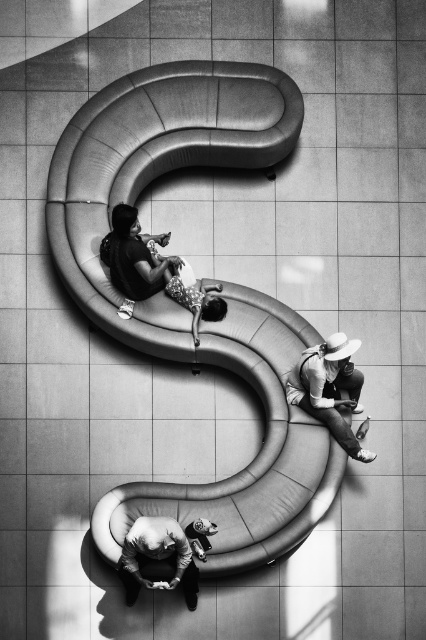
From the picture: Does matte black dress at center have a larger size compared to matte white hat at lower right?

Yes.

Does matte black dress at center have a greater height compared to matte white hat at lower right?

Yes, matte black dress at center is taller than matte white hat at lower right.

The height and width of the screenshot is (640, 426). What do you see at coordinates (152, 268) in the screenshot?
I see `matte black dress at center` at bounding box center [152, 268].

Where is `matte black dress at center`? matte black dress at center is located at coordinates (152, 268).

Does matte white hat at lower right have a larger size compared to smooth leather jacket at lower center?

Incorrect, matte white hat at lower right is not larger than smooth leather jacket at lower center.

Can you confirm if matte white hat at lower right is positioned to the right of smooth leather jacket at lower center?

Yes, matte white hat at lower right is to the right of smooth leather jacket at lower center.

What do you see at coordinates (330, 388) in the screenshot? The width and height of the screenshot is (426, 640). I see `matte white hat at lower right` at bounding box center [330, 388].

This screenshot has height=640, width=426. Find the location of `matte white hat at lower right`. matte white hat at lower right is located at coordinates (330, 388).

Does matte black dress at center lie behind smooth leather jacket at lower center?

Yes, it is.

Can you confirm if matte black dress at center is positioned to the left of smooth leather jacket at lower center?

Incorrect, matte black dress at center is not on the left side of smooth leather jacket at lower center.

Who is more distant from viewer, (221, 314) or (193, 563)?

The point (221, 314) is behind.

Identify the location of matte black dress at center. (152, 268).